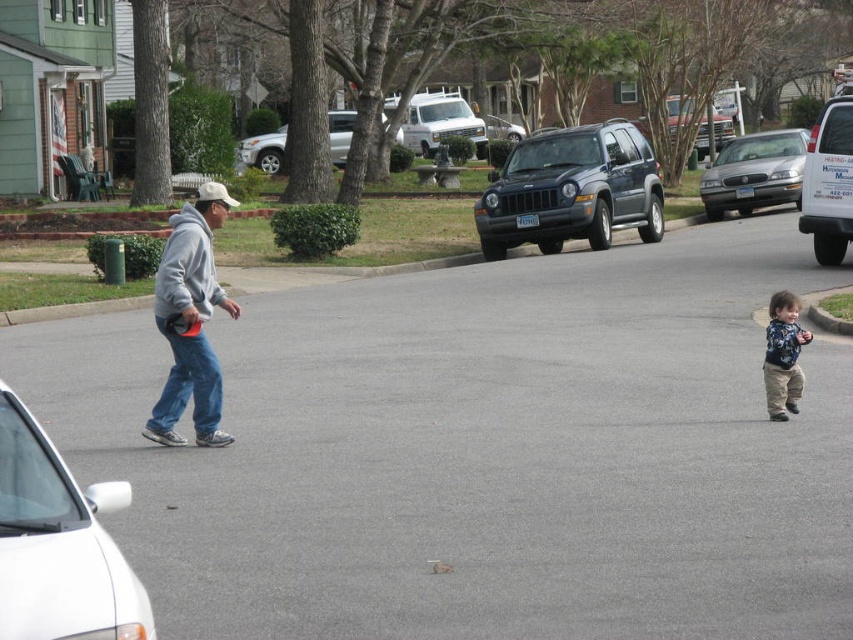
Is point (62, 480) closer to camera compared to point (770, 385)?

Yes, it is.

Which is in front, point (10, 412) or point (793, 349)?

Point (10, 412) is more forward.

Is point (96, 492) positioned before point (764, 372)?

Yes, point (96, 492) is in front of point (764, 372).

The height and width of the screenshot is (640, 853). What are the coordinates of `white glossy car at lower left` in the screenshot? It's located at (59, 544).

Can you confirm if white glossy car at lower left is taller than silver metallic suv at upper center?

In fact, white glossy car at lower left may be shorter than silver metallic suv at upper center.

Is white glossy car at lower left shorter than silver metallic suv at upper center?

Yes.

Between point (86, 540) and point (350, 124), which one is positioned in front?

Point (86, 540) is in front.

Locate an element on the screen. white glossy car at lower left is located at coordinates (59, 544).

Is dark gray matte suv at center bigger than silver metallic suv at upper center?

Incorrect, dark gray matte suv at center is not larger than silver metallic suv at upper center.

Can you confirm if dark gray matte suv at center is taller than silver metallic suv at upper center?

In fact, dark gray matte suv at center may be shorter than silver metallic suv at upper center.

At what (x,y) coordinates should I click in order to perform the action: click on dark gray matte suv at center. Please return your answer as a coordinate pair (x, y). This screenshot has width=853, height=640. Looking at the image, I should click on (572, 189).